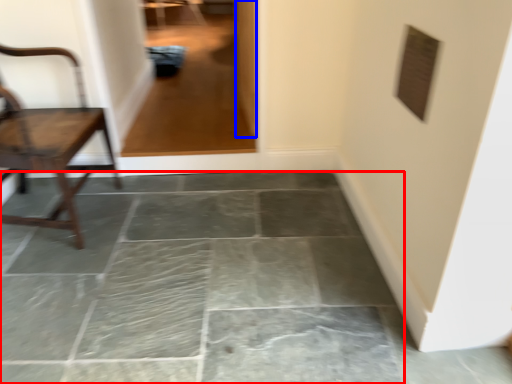
Question: Which object is closer to the camera taking this photo, concrete (highlighted by a red box) or glass door (highlighted by a blue box)?

Choices:
 (A) concrete
 (B) glass door

Answer: (A)